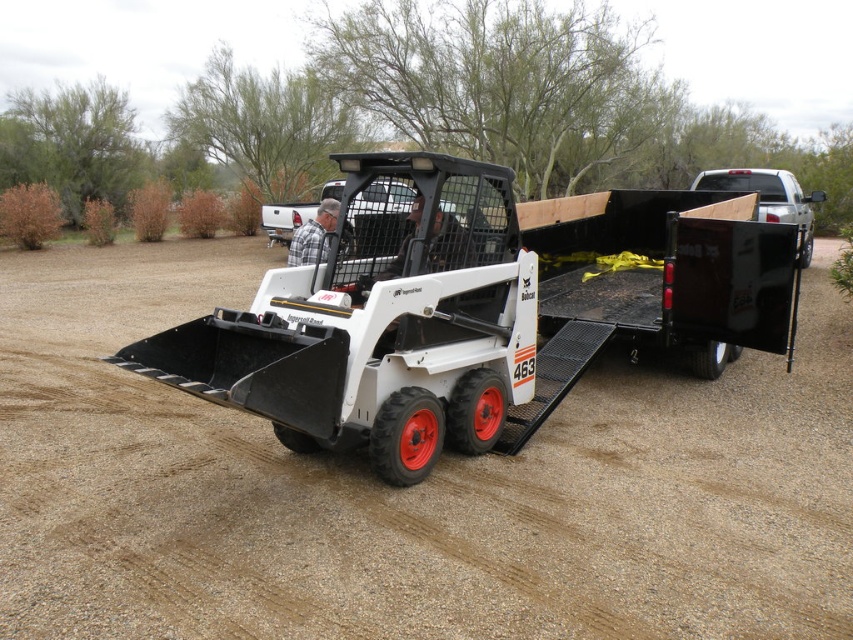
Question: Which of the following is the farthest from the observer?

Choices:
 (A) wooden board at right
 (B) plaid fabric shirt at center

Answer: (B)

Question: Can you confirm if dirt track at center is positioned below plaid fabric shirt at center?

Choices:
 (A) yes
 (B) no

Answer: (A)

Question: Which of the following is the farthest from the observer?

Choices:
 (A) plaid fabric shirt at center
 (B) wooden board at right

Answer: (A)

Question: Where is wooden board at right located in relation to plaid fabric shirt at center in the image?

Choices:
 (A) right
 (B) left

Answer: (A)

Question: Based on their relative distances, which object is farther from the wooden board at right?

Choices:
 (A) black metal trailer truck at center
 (B) dirt track at center
 (C) plaid fabric shirt at center

Answer: (A)

Question: Can you confirm if black metal trailer truck at center is positioned above wooden board at right?

Choices:
 (A) yes
 (B) no

Answer: (B)